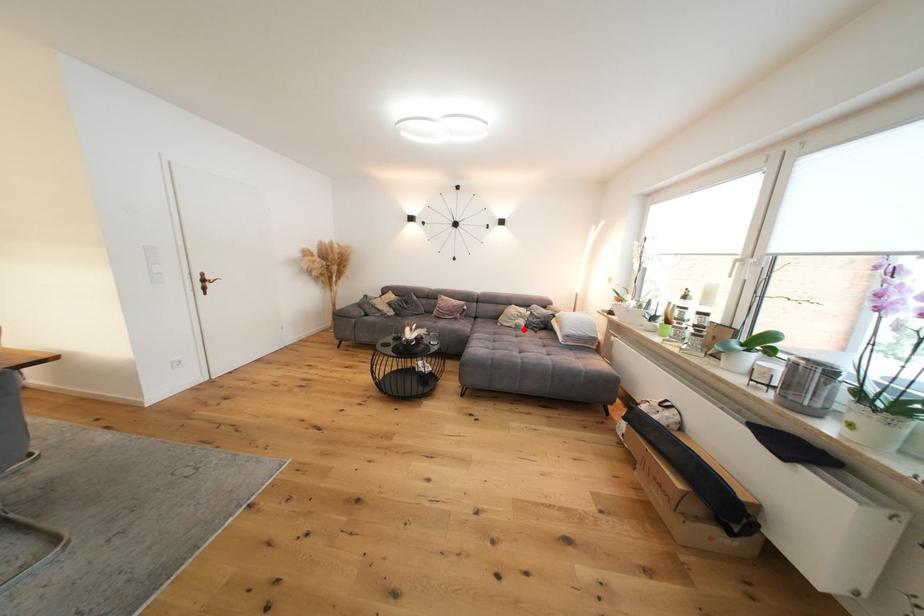
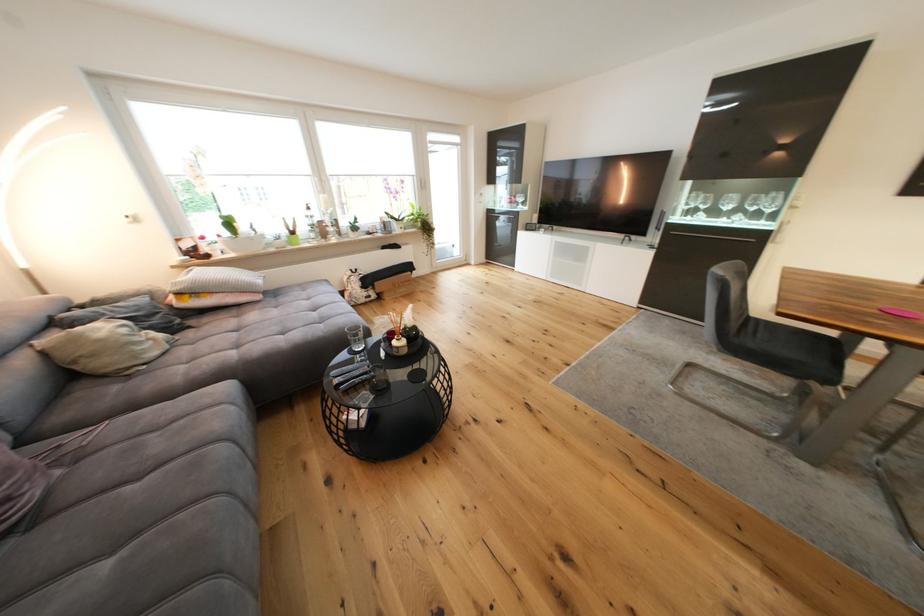
Question: A red point is marked in image1. In image2, is the corresponding 3D point closer to the camera or farther? Reply with the corresponding letter.

Choices:
 (A) The corresponding 3D point is closer.
 (B) The corresponding 3D point is farther.

Answer: (A)